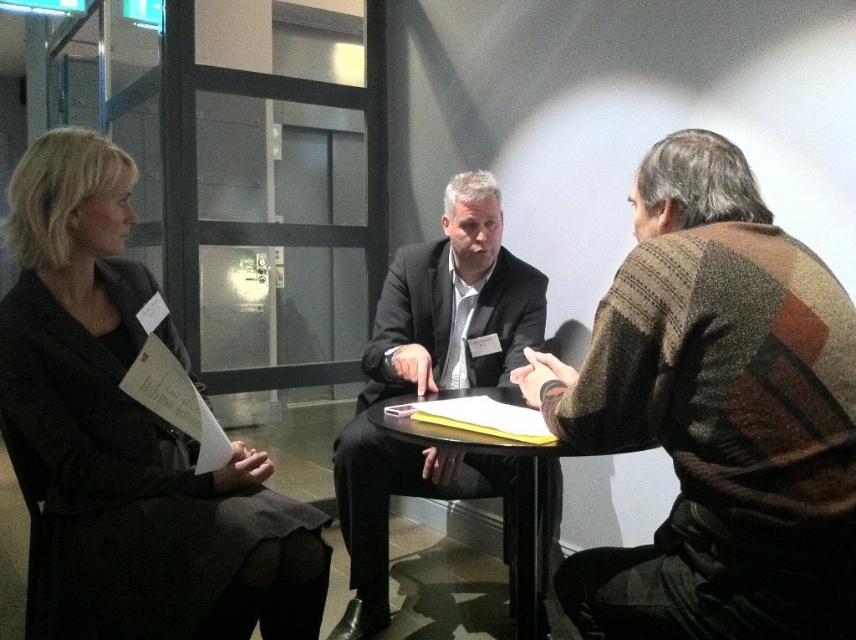
Question: Is matte black coat at left thinner than dark gray suit at center?

Choices:
 (A) no
 (B) yes

Answer: (B)

Question: Which object is closer to the camera taking this photo?

Choices:
 (A) matte black coat at left
 (B) black glossy table at center
 (C) dark gray suit at center

Answer: (B)

Question: Where is striped wool sweater at right located in relation to matte black coat at left in the image?

Choices:
 (A) left
 (B) right

Answer: (B)

Question: Which of these objects is positioned closest to the striped wool sweater at right?

Choices:
 (A) matte black coat at left
 (B) dark gray suit at center

Answer: (B)

Question: Which point appears closest to the camera in this image?

Choices:
 (A) (203, 522)
 (B) (413, 364)
 (C) (544, 632)
 (D) (717, 566)

Answer: (D)

Question: Can you confirm if striped wool sweater at right is thinner than dark gray suit at center?

Choices:
 (A) yes
 (B) no

Answer: (A)